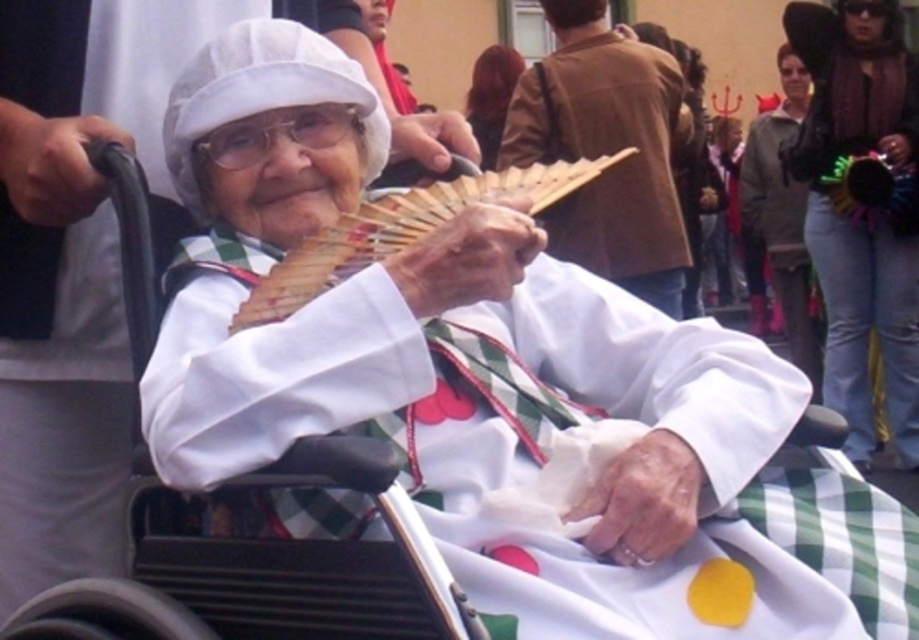
Question: Among these points, which one is nearest to the camera?

Choices:
 (A) (486, 129)
 (B) (462, 189)

Answer: (B)

Question: Does wooden fan at center appear under matte brown leather jacket at upper center?

Choices:
 (A) yes
 (B) no

Answer: (A)

Question: Can you confirm if wooden fan at center is positioned above matte brown leather jacket at upper center?

Choices:
 (A) yes
 (B) no

Answer: (B)

Question: Among these objects, which one is farthest from the camera?

Choices:
 (A) wooden fan at center
 (B) matte brown leather jacket at upper center

Answer: (B)

Question: Observing the image, what is the correct spatial positioning of wooden fan at center in reference to matte brown leather jacket at upper center?

Choices:
 (A) below
 (B) above

Answer: (A)